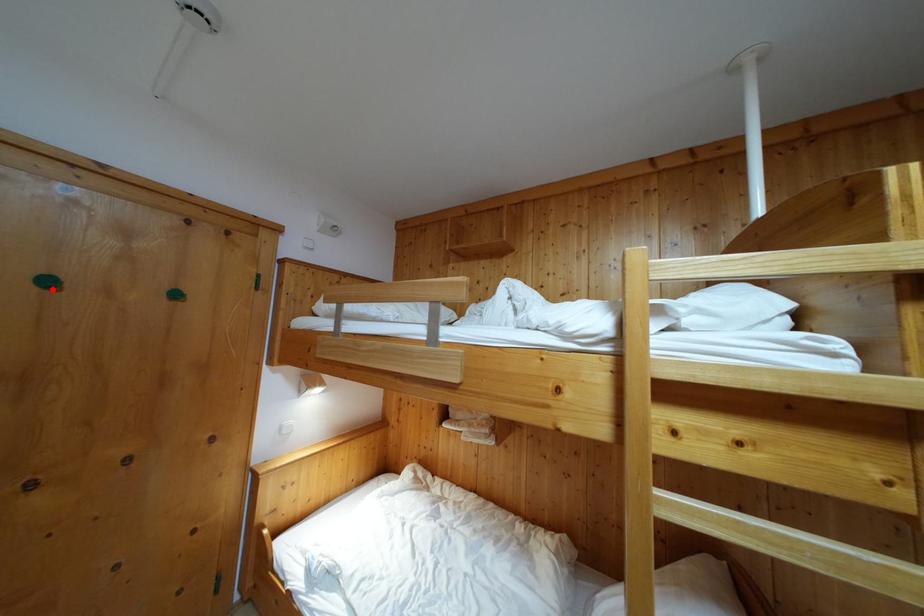
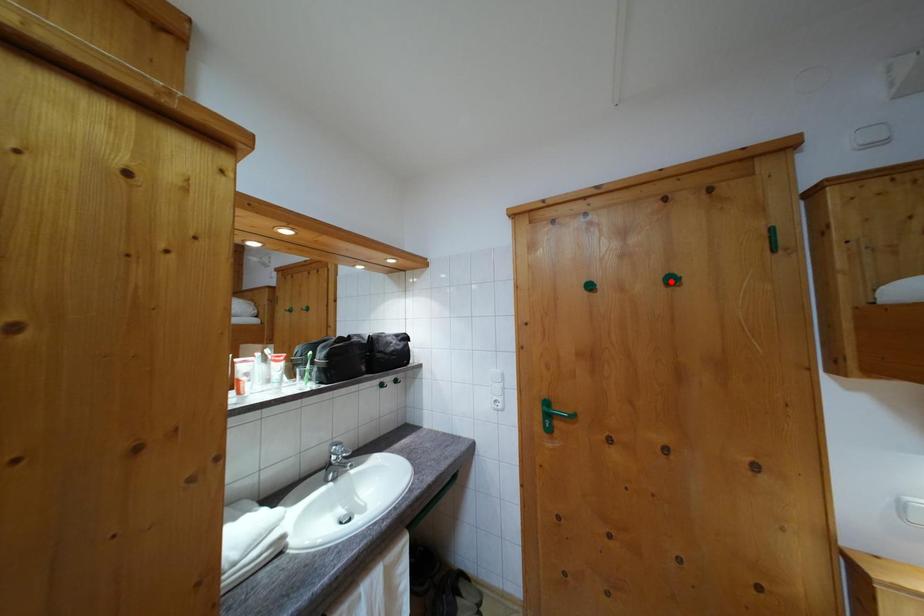
I am providing you with two images of the same scene from different viewpoints. A red point is marked on the first image and another point is marked on the second image. Is the red point in image1 aligned with the point shown in image2?

No